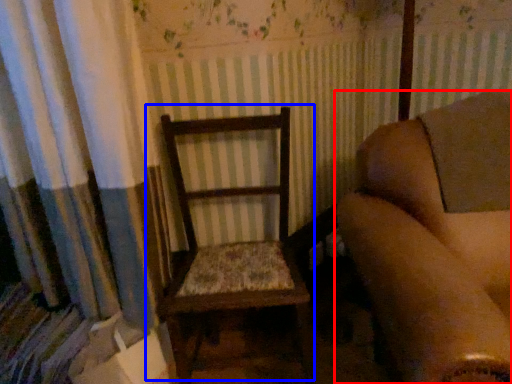
Question: Among these objects, which one is farthest to the camera, chair (highlighted by a red box) or rocking chair (highlighted by a blue box)?

Choices:
 (A) chair
 (B) rocking chair

Answer: (B)